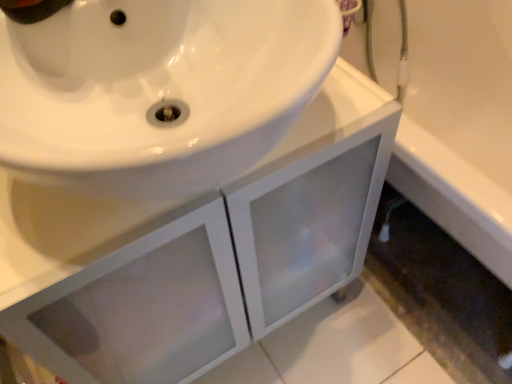
Looking at this image, measure the distance between white frosted glass cabinet at center and camera.

white frosted glass cabinet at center is 18.63 inches from camera.

Identify the location of white frosted glass cabinet at center. This screenshot has width=512, height=384. (196, 251).

The width and height of the screenshot is (512, 384). What do you see at coordinates (196, 251) in the screenshot? I see `white frosted glass cabinet at center` at bounding box center [196, 251].

What is the approximate width of white glossy bathtub at lower right?

The width of white glossy bathtub at lower right is 16.35 inches.

Measure the distance between white glossy bathtub at lower right and camera.

white glossy bathtub at lower right is 3.58 feet from camera.

Describe the element at coordinates (460, 124) in the screenshot. Image resolution: width=512 pixels, height=384 pixels. I see `white glossy bathtub at lower right` at that location.

Where is `white glossy bathtub at lower right`? This screenshot has height=384, width=512. white glossy bathtub at lower right is located at coordinates (460, 124).

Where is `white frosted glass cabinet at center`? This screenshot has width=512, height=384. white frosted glass cabinet at center is located at coordinates click(196, 251).

Between white glossy bathtub at lower right and white frosted glass cabinet at center, which one appears on the left side from the viewer's perspective?

white frosted glass cabinet at center.

Between white glossy bathtub at lower right and white frosted glass cabinet at center, which one is positioned in front?

Positioned in front is white frosted glass cabinet at center.

Does point (437, 74) come behind point (67, 299)?

That is True.

From the image's perspective, is white glossy bathtub at lower right over white frosted glass cabinet at center?

Yes.

From a real-world perspective, who is located higher, white glossy bathtub at lower right or white frosted glass cabinet at center?

From a 3D spatial view, white glossy bathtub at lower right is above.

Is white glossy bathtub at lower right thinner than white frosted glass cabinet at center?

No.

In terms of height, does white glossy bathtub at lower right look taller or shorter compared to white frosted glass cabinet at center?

Considering their sizes, white glossy bathtub at lower right has less height than white frosted glass cabinet at center.

Considering the sizes of white glossy bathtub at lower right and white frosted glass cabinet at center in the image, is white glossy bathtub at lower right bigger or smaller than white frosted glass cabinet at center?

In the image, white glossy bathtub at lower right appears to be smaller than white frosted glass cabinet at center.

Is white frosted glass cabinet at center located within white glossy bathtub at lower right?

No, white glossy bathtub at lower right does not contain white frosted glass cabinet at center.

Is white glossy bathtub at lower right beside white frosted glass cabinet at center?

white glossy bathtub at lower right and white frosted glass cabinet at center are clearly separated.

Is white glossy bathtub at lower right facing away from white frosted glass cabinet at center?

That's not correct — white glossy bathtub at lower right is not looking away from white frosted glass cabinet at center.

The width and height of the screenshot is (512, 384). Find the location of `bathroom cabinet in front of the white glossy bathtub at lower right`. bathroom cabinet in front of the white glossy bathtub at lower right is located at coordinates (196, 251).

Considering the positions of objects white frosted glass cabinet at center and white glossy bathtub at lower right in the image provided, who is more to the left, white frosted glass cabinet at center or white glossy bathtub at lower right?

white frosted glass cabinet at center.

Is the depth of white frosted glass cabinet at center greater than that of white glossy bathtub at lower right?

No, it is not.

Which point is more distant from viewer, (221, 279) or (468, 31)?

Positioned behind is point (468, 31).

From the image's perspective, which object appears higher, white frosted glass cabinet at center or white glossy bathtub at lower right?

white glossy bathtub at lower right is shown above in the image.

From a real-world perspective, between white frosted glass cabinet at center and white glossy bathtub at lower right, who is vertically higher?

white glossy bathtub at lower right.

Which of these two, white frosted glass cabinet at center or white glossy bathtub at lower right, is thinner?

Thinner between the two is white frosted glass cabinet at center.

Does white frosted glass cabinet at center have a lesser height compared to white glossy bathtub at lower right?

No, white frosted glass cabinet at center is not shorter than white glossy bathtub at lower right.

In terms of size, does white frosted glass cabinet at center appear bigger or smaller than white glossy bathtub at lower right?

In the image, white frosted glass cabinet at center appears to be larger than white glossy bathtub at lower right.

Is white glossy bathtub at lower right completely or partially inside white frosted glass cabinet at center?

No, white glossy bathtub at lower right is located outside of white frosted glass cabinet at center.

Is white frosted glass cabinet at center in contact with white glossy bathtub at lower right?

white frosted glass cabinet at center is not next to white glossy bathtub at lower right, and they're not touching.

Is white frosted glass cabinet at center positioned with its back to white glossy bathtub at lower right?

No, white glossy bathtub at lower right is not at the back of white frosted glass cabinet at center.

How different are the orientations of white frosted glass cabinet at center and white glossy bathtub at lower right in degrees?

There is a 1.84-degree angle between the facing directions of white frosted glass cabinet at center and white glossy bathtub at lower right.

Identify the location of bath on the right of white frosted glass cabinet at center. (460, 124).

Identify the location of bath to the right of white frosted glass cabinet at center. The image size is (512, 384). (460, 124).

The height and width of the screenshot is (384, 512). I want to click on bath that appears above the white frosted glass cabinet at center (from a real-world perspective), so click(460, 124).